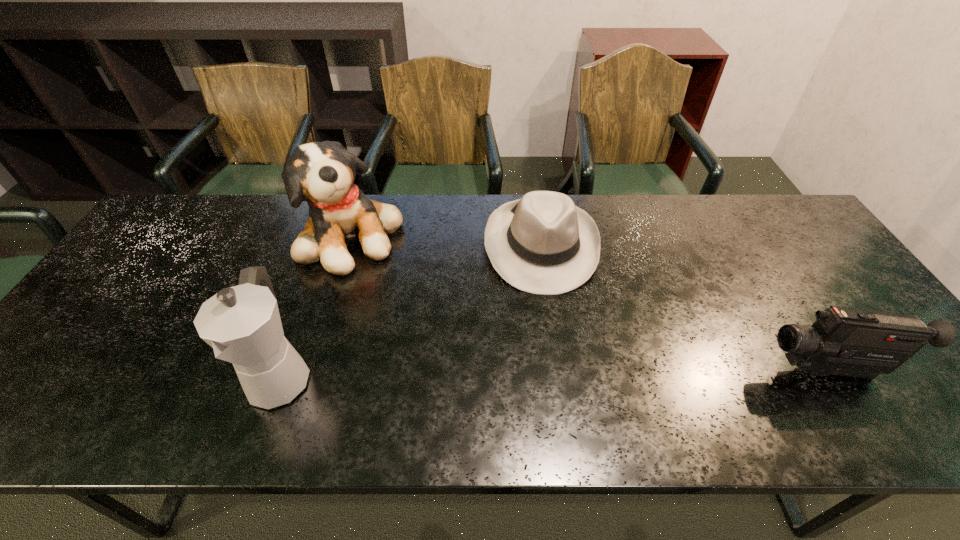
Image resolution: width=960 pixels, height=540 pixels. Find the location of `coffeepot`. coffeepot is located at coordinates (242, 324).

I want to click on the rightmost object, so coord(851,342).

This screenshot has height=540, width=960. Find the location of `camcorder`. camcorder is located at coordinates (851, 342).

Where is `the second object from right to left`? The height and width of the screenshot is (540, 960). the second object from right to left is located at coordinates (542, 243).

The height and width of the screenshot is (540, 960). Find the location of `the shortest object`. the shortest object is located at coordinates (542, 243).

Where is `puppy`? puppy is located at coordinates (322, 173).

Identify the location of vacant position located on the right of the coffeepot. (337, 376).

Identify the location of free point located 0.080m on the front-facing side of the camcorder. (727, 370).

Identify the location of free point located 0.250m on the front-facing side of the camcorder. The height and width of the screenshot is (540, 960). (653, 370).

Image resolution: width=960 pixels, height=540 pixels. Find the location of `free space located on the front-facing side of the camcorder`. free space located on the front-facing side of the camcorder is located at coordinates (740, 370).